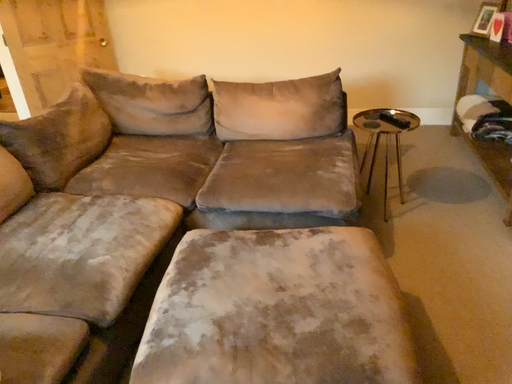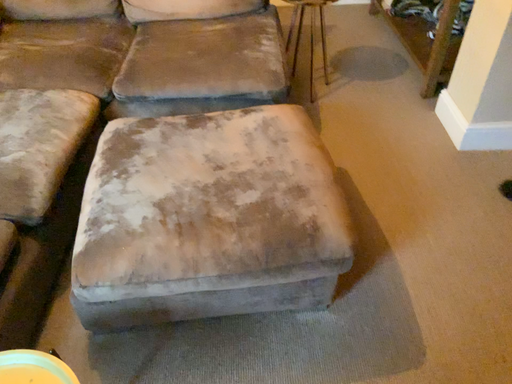
Question: Which way did the camera rotate in the video?

Choices:
 (A) rotated right
 (B) rotated left

Answer: (A)